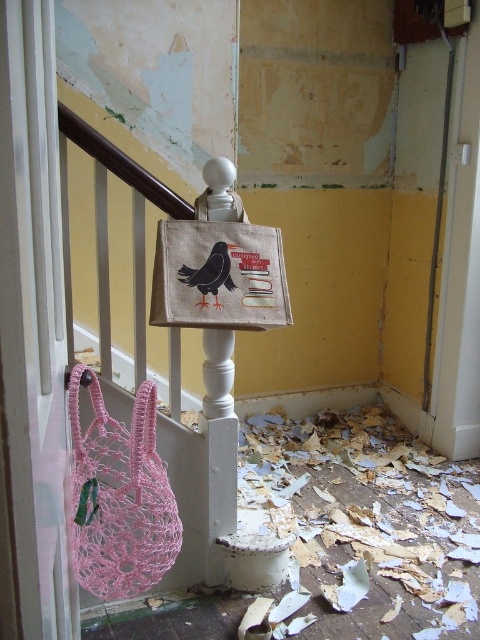
Based on the photo, is canvas bird-patterned bag at center wider than matte black bird at center?

Indeed, canvas bird-patterned bag at center has a greater width compared to matte black bird at center.

Is point (276, 292) positioned before point (208, 285)?

No, it is not.

Locate an element on the screen. The height and width of the screenshot is (640, 480). canvas bird-patterned bag at center is located at coordinates (218, 273).

Between pink crochet bag at lower left and matte black bird at center, which one has less height?

Standing shorter between the two is matte black bird at center.

Is pink crochet bag at lower left behind matte black bird at center?

No, pink crochet bag at lower left is in front of matte black bird at center.

Find the location of a particular element. pink crochet bag at lower left is located at coordinates (120, 496).

Locate an element on the screen. Image resolution: width=480 pixels, height=640 pixels. pink crochet bag at lower left is located at coordinates (120, 496).

Which is in front, point (151, 486) or point (195, 243)?

Point (151, 486) is more forward.

From the picture: Who is lower down, pink crochet bag at lower left or canvas bird-patterned bag at center?

pink crochet bag at lower left is lower down.

At what (x,y) coordinates should I click in order to perform the action: click on pink crochet bag at lower left. Please return your answer as a coordinate pair (x, y). Image resolution: width=480 pixels, height=640 pixels. Looking at the image, I should click on (120, 496).